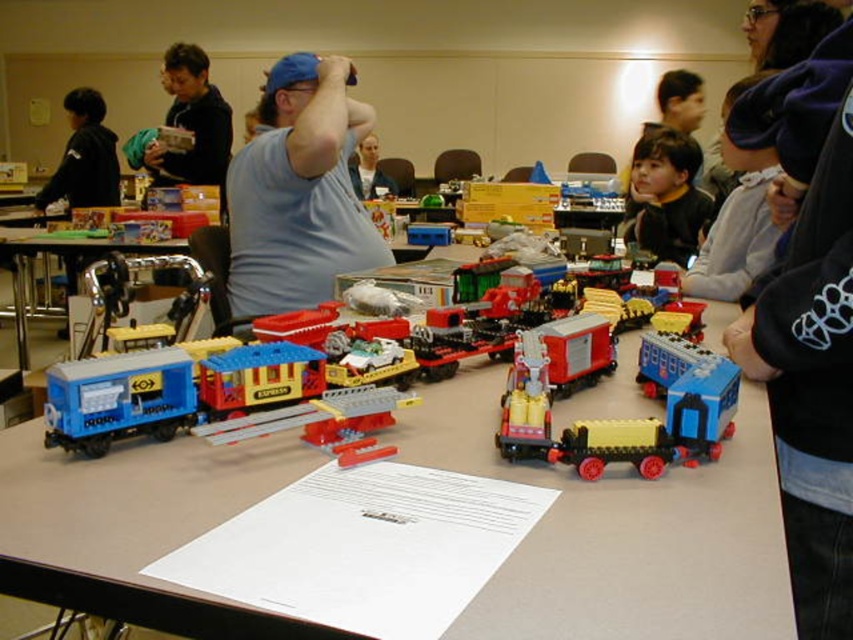
Does white paper at center appear on the right side of matte blue shirt at center?

Indeed, white paper at center is positioned on the right side of matte blue shirt at center.

Looking at this image, who is more distant from viewer, (722, 518) or (364, 196)?

Point (364, 196)

The height and width of the screenshot is (640, 853). Describe the element at coordinates (618, 532) in the screenshot. I see `white paper at center` at that location.

Where is `white paper at center`? white paper at center is located at coordinates (618, 532).

Who is taller, brushed metal box at upper left or black jacket at left?

With more height is brushed metal box at upper left.

Who is more distant from viewer, (201, 118) or (107, 163)?

Point (107, 163)

You are a GUI agent. You are given a task and a screenshot of the screen. Output one action in this format:
    pyautogui.click(x=<x>, y=<y>)
    Task: Click on the brushed metal box at upper left
    The image size is (853, 640).
    Given the screenshot: What is the action you would take?
    pyautogui.click(x=192, y=124)

Who is higher up, brushed metal box at upper left or smooth brown hair at upper center?

smooth brown hair at upper center

Who is lower down, brushed metal box at upper left or smooth brown hair at upper center?

brushed metal box at upper left

Locate an element on the screen. Image resolution: width=853 pixels, height=640 pixels. brushed metal box at upper left is located at coordinates (192, 124).

The height and width of the screenshot is (640, 853). What are the coordinates of `brushed metal box at upper left` in the screenshot? It's located at (192, 124).